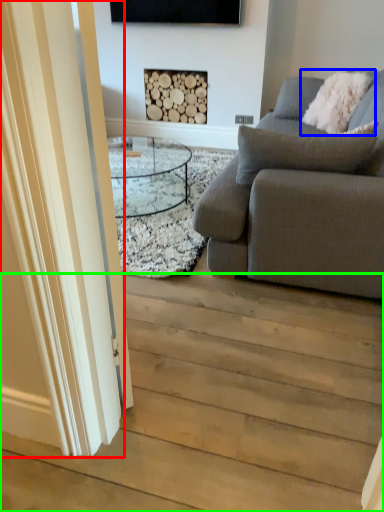
Question: Which object is the closest to the glass door (highlighted by a red box)? Choose among these: pillow (highlighted by a blue box) or stairwell (highlighted by a green box).

Choices:
 (A) pillow
 (B) stairwell

Answer: (B)